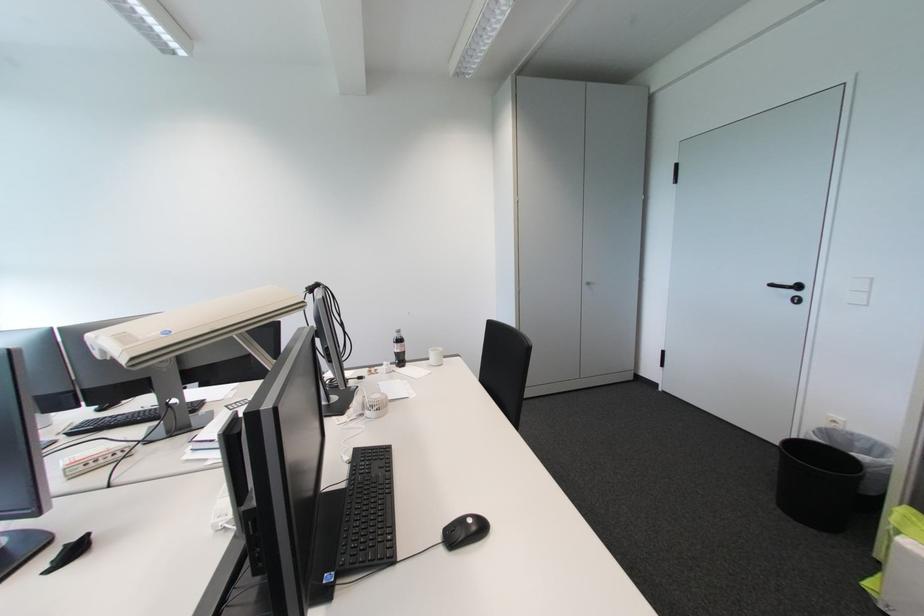
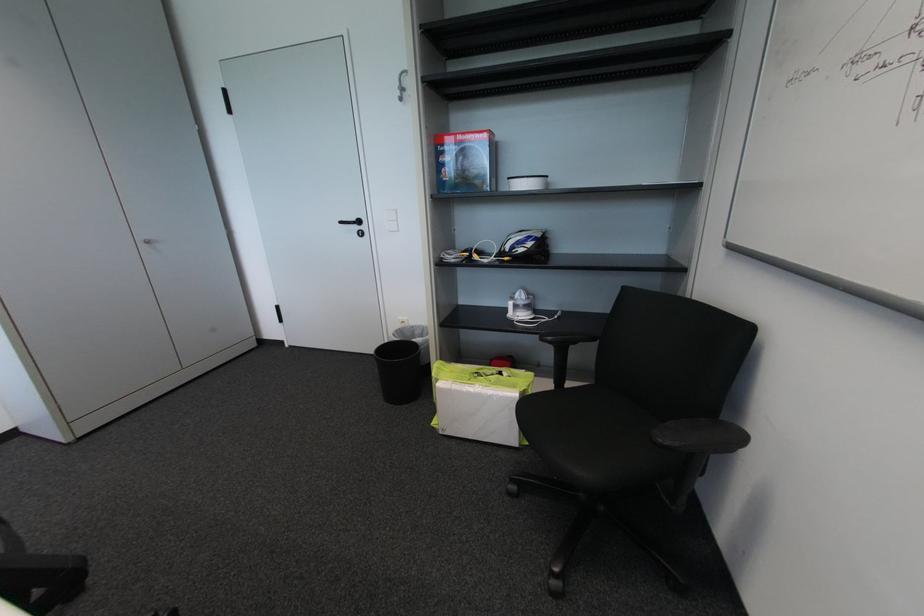
The point at (797, 294) is marked in the first image. Where is the corresponding point in the second image?

(362, 229)